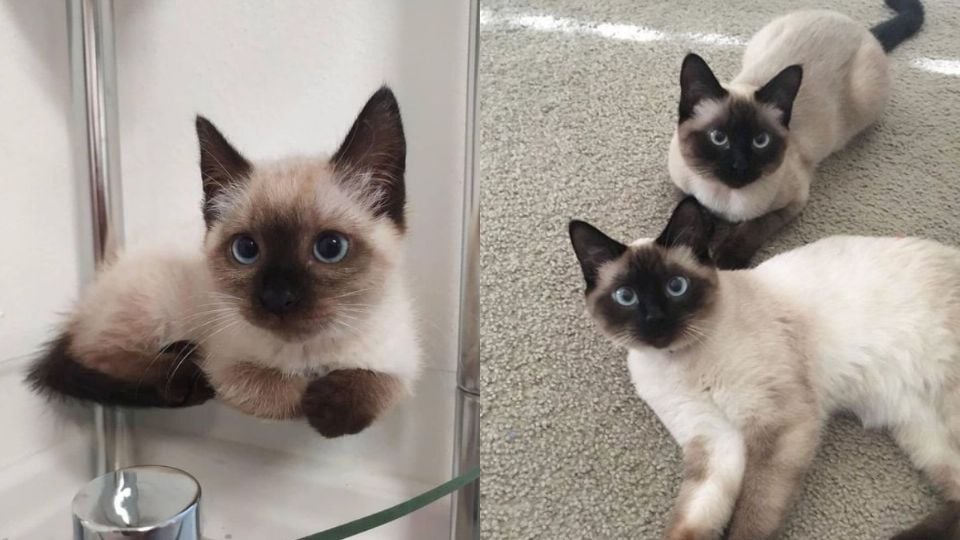
In order to click on shelf in this screenshot , I will do `click(306, 475)`.